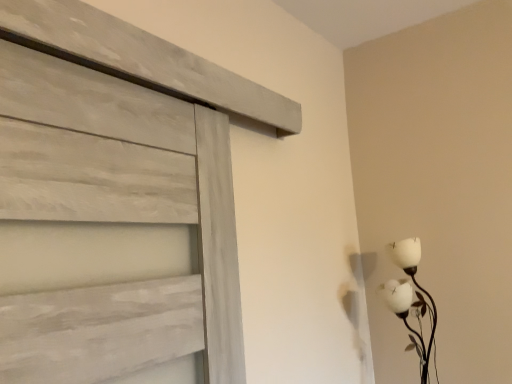
Question: Should I look upward or downward to see white matte table lamp at right?

Choices:
 (A) up
 (B) down

Answer: (B)